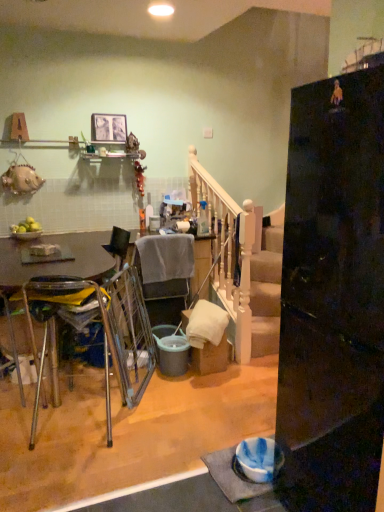
You are a GUI agent. You are given a task and a screenshot of the screen. Output one action in this format:
    pyautogui.click(x=<x>, y=<y>)
    Task: Click on the vacant area located to the right-hand side of metallic silver swivel chair at center
    Image resolution: width=384 pixels, height=512 pixels.
    Given the screenshot: What is the action you would take?
    pyautogui.click(x=186, y=394)